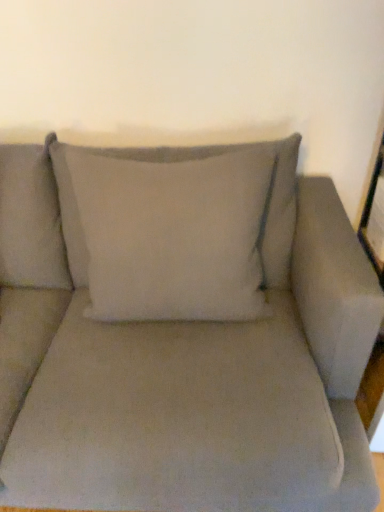
Question: From a real-world perspective, relative to white cotton pillow at center, is matte gray couch at center vertically above or below?

Choices:
 (A) above
 (B) below

Answer: (B)

Question: From their relative heights in the image, would you say matte gray couch at center is taller or shorter than white cotton pillow at center?

Choices:
 (A) tall
 (B) short

Answer: (A)

Question: Is matte gray couch at center wider or thinner than white cotton pillow at center?

Choices:
 (A) thin
 (B) wide

Answer: (B)

Question: From their relative heights in the image, would you say white cotton pillow at center is taller or shorter than matte gray couch at center?

Choices:
 (A) tall
 (B) short

Answer: (B)

Question: Does point (200, 234) appear closer or farther from the camera than point (87, 399)?

Choices:
 (A) farther
 (B) closer

Answer: (A)

Question: From a real-world perspective, is white cotton pillow at center positioned above or below matte gray couch at center?

Choices:
 (A) below
 (B) above

Answer: (B)

Question: Based on their positions, is white cotton pillow at center located to the left or right of matte gray couch at center?

Choices:
 (A) left
 (B) right

Answer: (B)